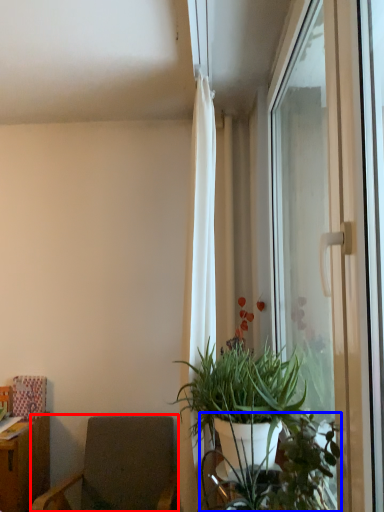
Question: Which object is closer to the camera taking this photo, chair (highlighted by a red box) or vegetation (highlighted by a blue box)?

Choices:
 (A) chair
 (B) vegetation

Answer: (B)